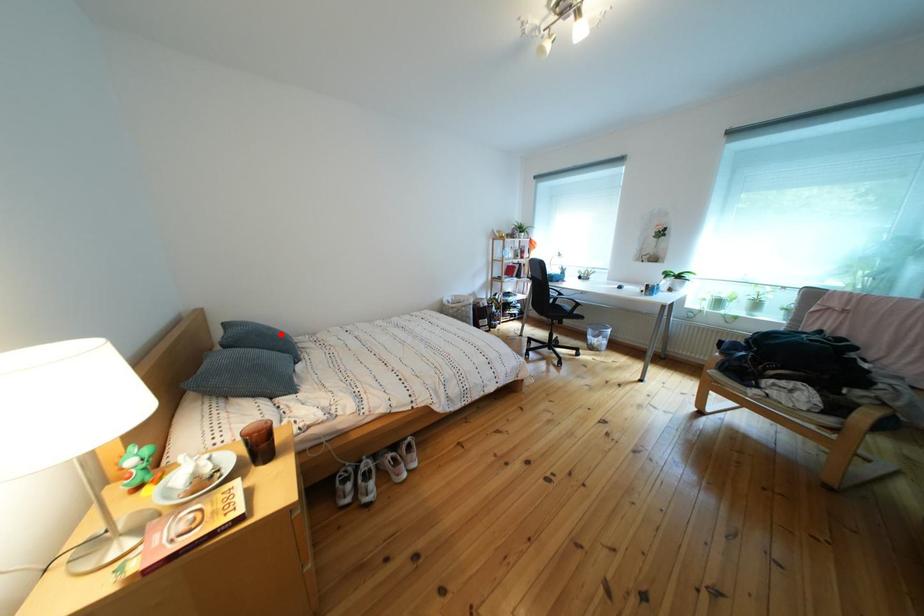
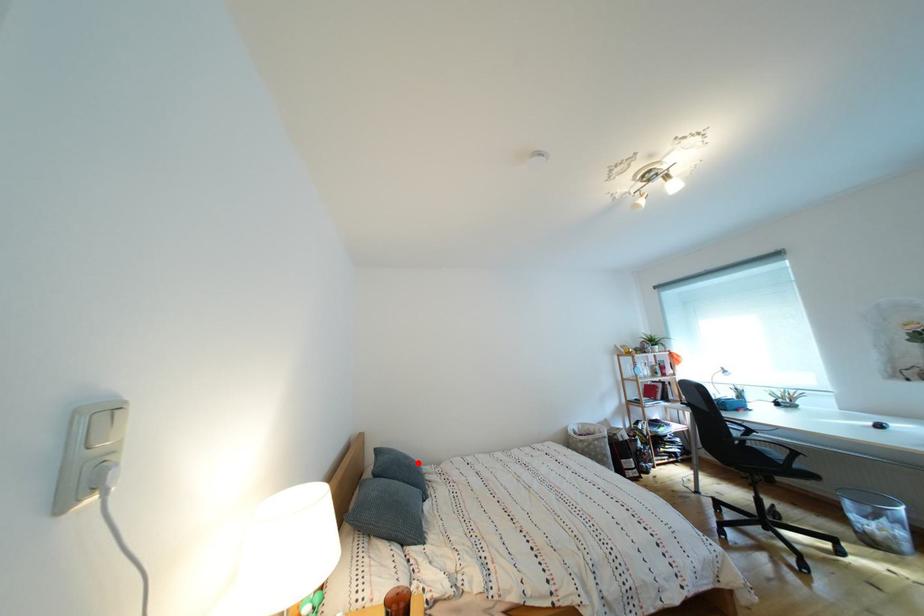
Consider the image. I am providing you with two images of the same scene from different viewpoints. A red point is marked on the first image and another point is marked on the second image. Is the marked point in image1 the same physical position as the marked point in image2?

Yes